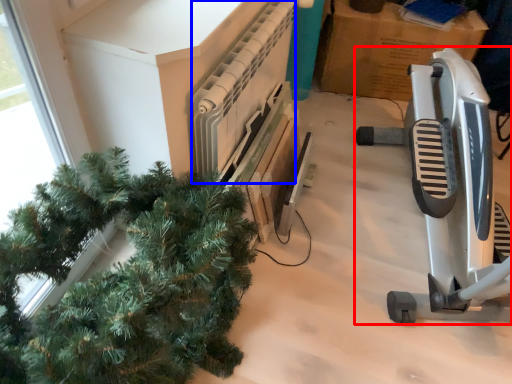
Question: Which object is further to the camera taking this photo, job (highlighted by a red box) or radiator (highlighted by a blue box)?

Choices:
 (A) job
 (B) radiator

Answer: (B)